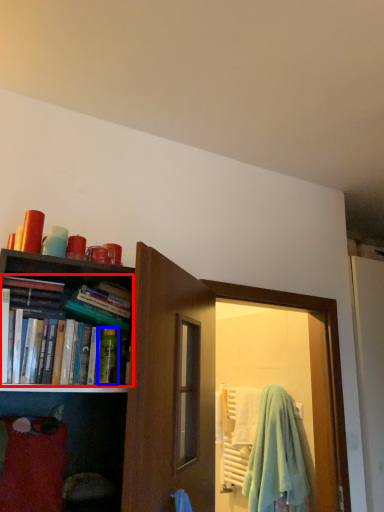
Question: Which object is further to the camera taking this photo, book (highlighted by a red box) or toiletry (highlighted by a blue box)?

Choices:
 (A) book
 (B) toiletry

Answer: (B)